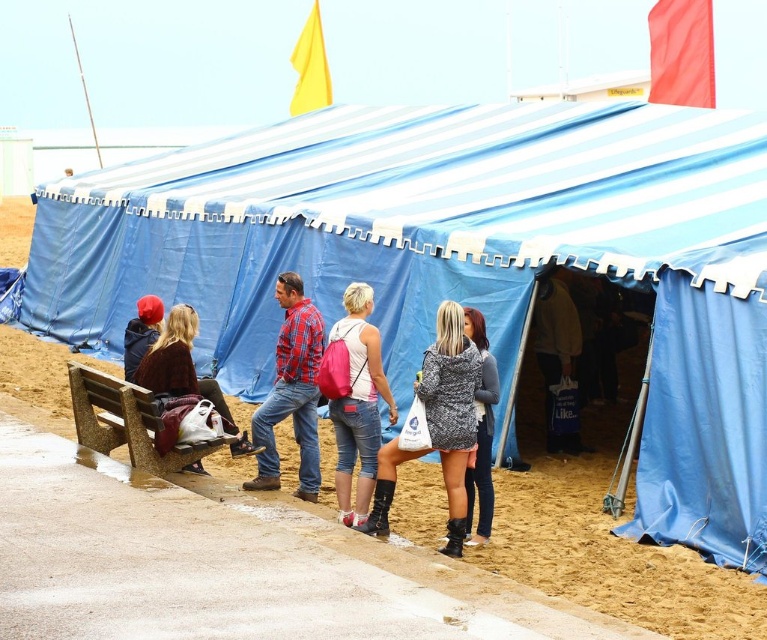
You are a photographer setting up a tripod to capture the beachside event. You need to ensure that both the speckled gray hoodie at center and the leather boots at lower center are clearly visible in the frame. Based on their heights, which object should you focus on first to ensure proper focus?

The speckled gray hoodie at center is taller than the leather boots at lower center, so you should focus on the speckled gray hoodie at center first to ensure proper focus since it is larger in the frame.

You are organizing a photo shoot and need to ensure that the plaid shirt at center and the matte black jacket at left can fit side by side on a 1.2 meter wide backdrop. Based on their sizes, will both items fit comfortably without overlapping?

The plaid shirt at center is wider than the matte black jacket at left. Since the plaid shirt at center is wider, the combined width of both items would exceed 1.2 meters, so they might not fit comfortably without overlapping.

You are standing in front of the large blue tent at the beachside event. There are two points marked on the tent fabric. One is at coordinate point (308, 372) and the other is at point (132, 355). Which of these points is closer to you?

Point (308, 372) is closer to the viewer than point (132, 355).